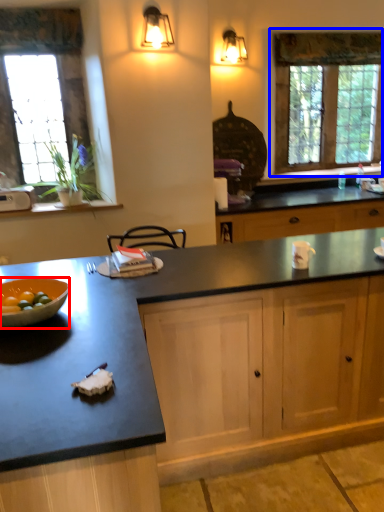
Question: Which point is closer to the camera, bowl (highlighted by a red box) or window (highlighted by a blue box)?

Choices:
 (A) bowl
 (B) window

Answer: (A)